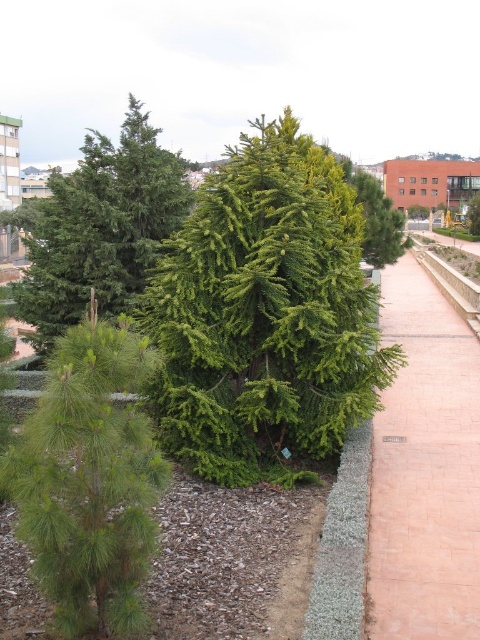
Based on the photo, you are a gardener planning to plant a new tree that requires a space of 3 meters in width. Based on the scene, can the green leafy tree at center and the pink brick pavement at right accommodate this requirement?

The green leafy tree at center has a lesser width compared to the pink brick pavement at right. Since the tree is narrower than the pavement, the pink brick pavement at right can accommodate the 3 meters width requirement, but the green leafy tree at center may not have enough space.

You are standing at the origin point of the coordinate system in the landscaped area. You want to walk towards the green leafy tree at center. In which direction should you head?

You should head towards the direction of the green leafy tree at center located at coordinate point (264, 316), which is slightly to the right and forward from your current position at the origin.